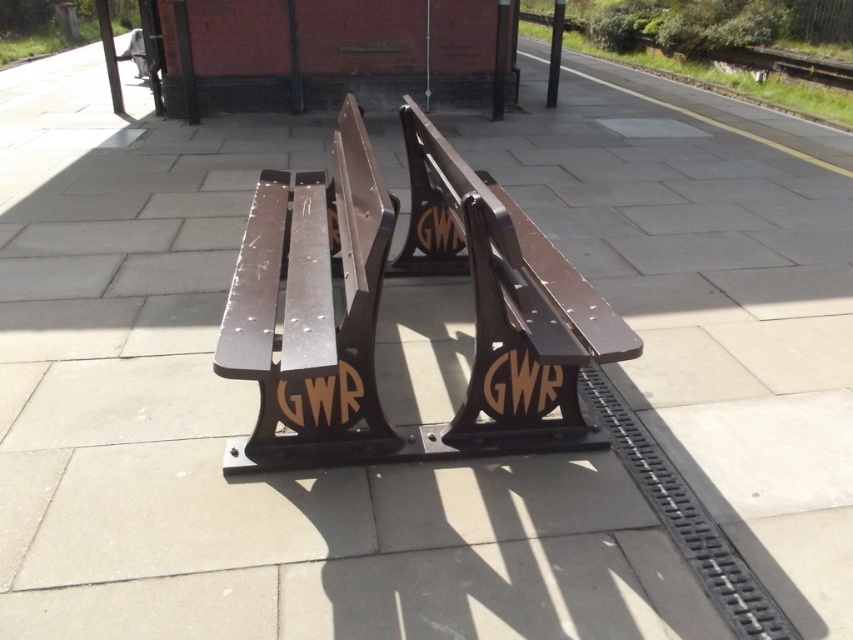
Question: Among these objects, which one is nearest to the camera?

Choices:
 (A) brown polished wood bench at center
 (B) metallic brown bench at center

Answer: (A)

Question: From the image, what is the correct spatial relationship of metallic brown bench at center in relation to brown polished wood bench at center?

Choices:
 (A) below
 (B) above

Answer: (B)

Question: Which object appears farthest from the camera in this image?

Choices:
 (A) metallic brown bench at center
 (B) brown polished wood bench at center

Answer: (A)

Question: Does metallic brown bench at center appear on the left side of brown polished wood bench at center?

Choices:
 (A) yes
 (B) no

Answer: (A)

Question: Can you confirm if metallic brown bench at center is thinner than brown polished wood bench at center?

Choices:
 (A) yes
 (B) no

Answer: (A)

Question: Which point is farther to the camera?

Choices:
 (A) metallic brown bench at center
 (B) brown polished wood bench at center

Answer: (A)